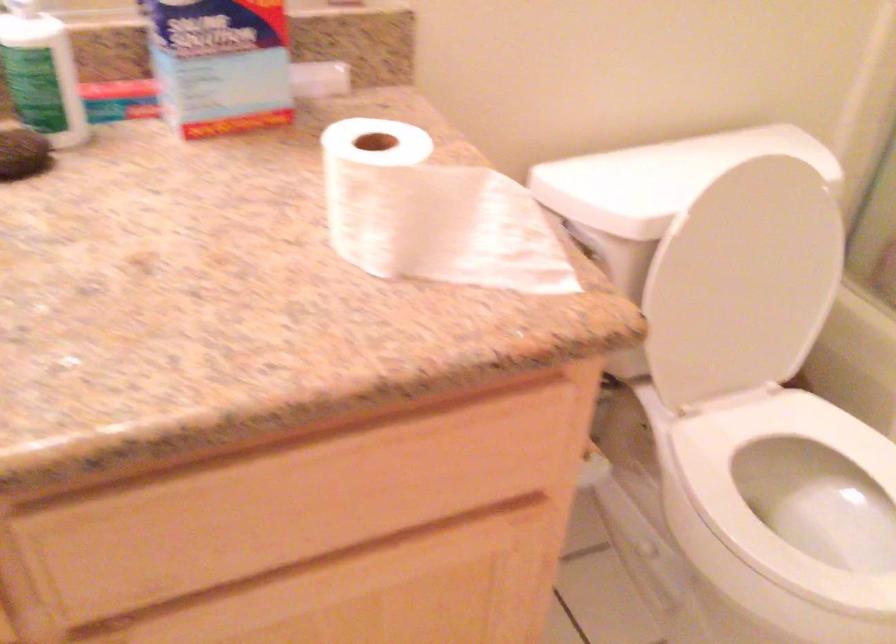
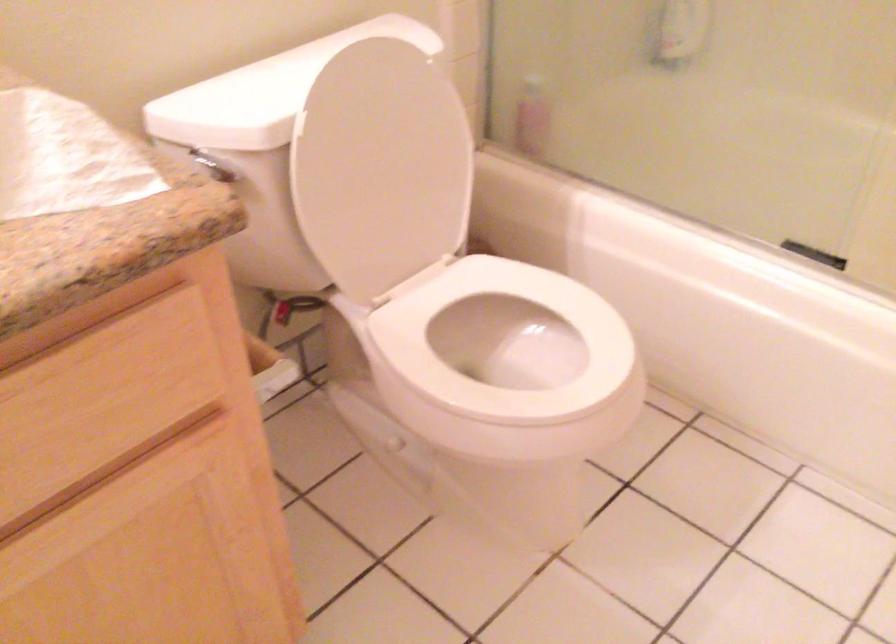
Locate, in the second image, the point that corresponds to the point at 795,497 in the first image.

(504, 348)